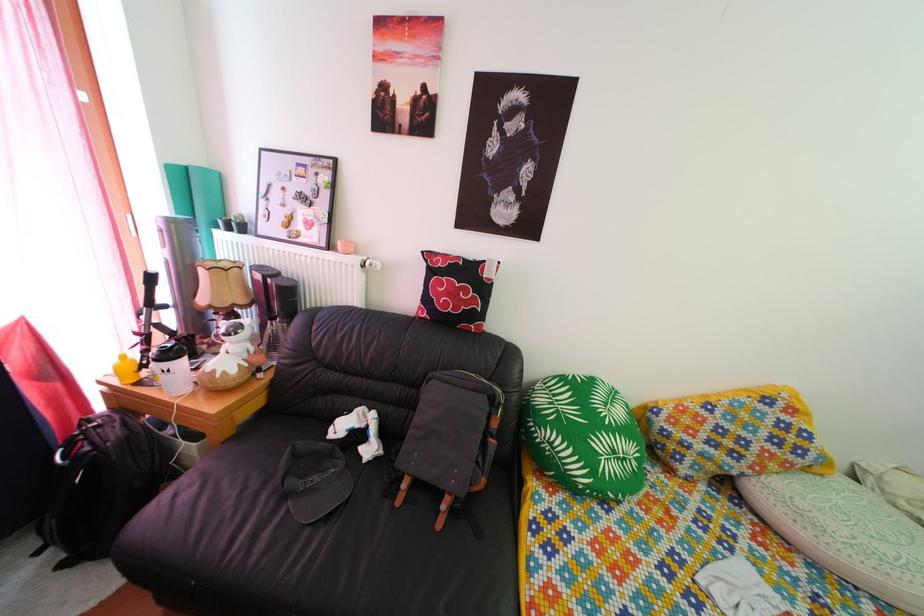
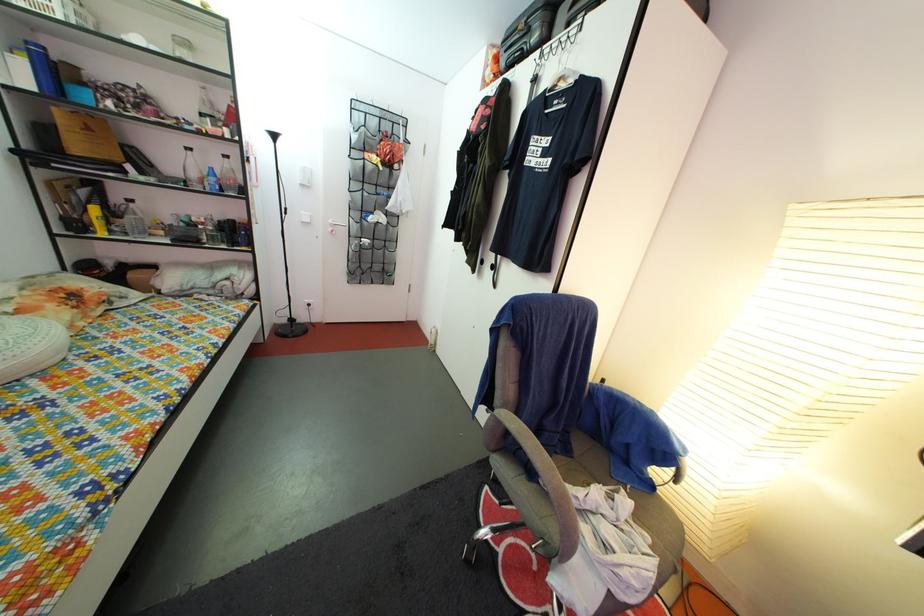
In the second image, find the point that corresponds to point 882,572 in the first image.

(9, 366)